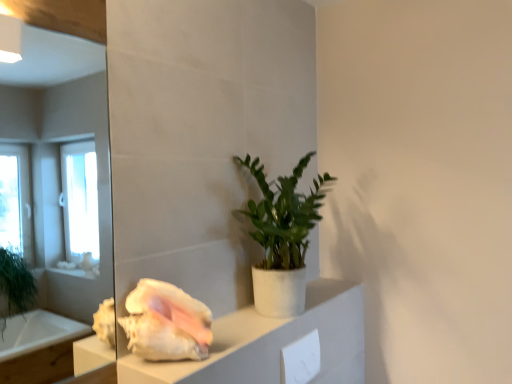
Question: Is white matte cabinet at center not near green matte plant at center?

Choices:
 (A) yes
 (B) no

Answer: (B)

Question: From the image's perspective, does white matte cabinet at center appear lower than green matte plant at center?

Choices:
 (A) no
 (B) yes

Answer: (B)

Question: Is green matte plant at center inside white matte cabinet at center?

Choices:
 (A) no
 (B) yes

Answer: (A)

Question: Can you confirm if white matte cabinet at center is thinner than green matte plant at center?

Choices:
 (A) yes
 (B) no

Answer: (A)

Question: Is white matte cabinet at center located outside green matte plant at center?

Choices:
 (A) yes
 (B) no

Answer: (A)

Question: From a real-world perspective, is white matte cabinet at center physically above green matte plant at center?

Choices:
 (A) no
 (B) yes

Answer: (A)

Question: From a real-world perspective, is green matte plant at center positioned over white glossy seashell at lower left based on gravity?

Choices:
 (A) no
 (B) yes

Answer: (B)

Question: Is there a large distance between green matte plant at center and white glossy seashell at lower left?

Choices:
 (A) no
 (B) yes

Answer: (A)

Question: Is green matte plant at center looking in the opposite direction of white glossy seashell at lower left?

Choices:
 (A) yes
 (B) no

Answer: (B)

Question: Is green matte plant at center thinner than white glossy seashell at lower left?

Choices:
 (A) no
 (B) yes

Answer: (A)

Question: Is green matte plant at center at the left side of white glossy seashell at lower left?

Choices:
 (A) yes
 (B) no

Answer: (B)

Question: From a real-world perspective, is green matte plant at center beneath white glossy seashell at lower left?

Choices:
 (A) yes
 (B) no

Answer: (B)

Question: Considering the relative sizes of green matte plant at center and white matte cabinet at center in the image provided, is green matte plant at center wider than white matte cabinet at center?

Choices:
 (A) yes
 (B) no

Answer: (A)